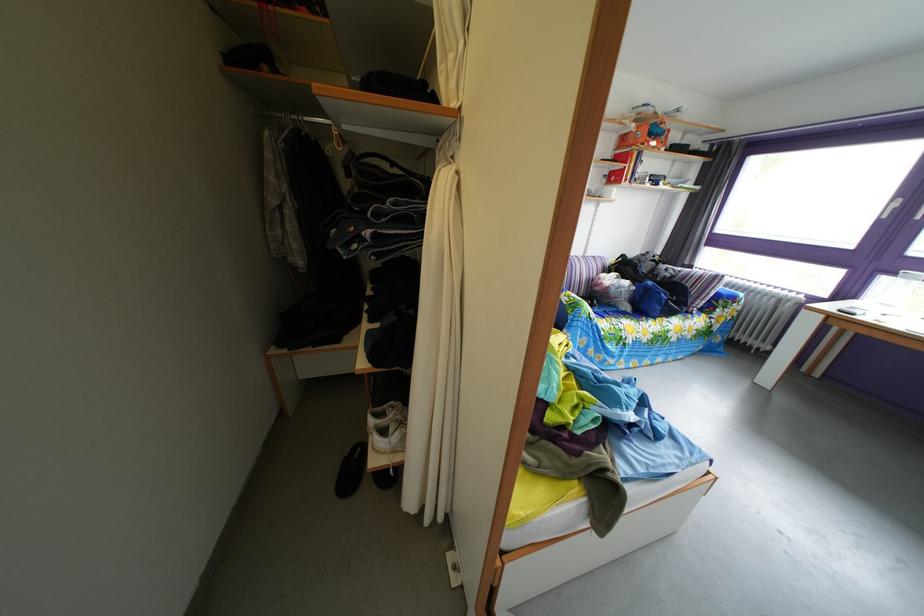
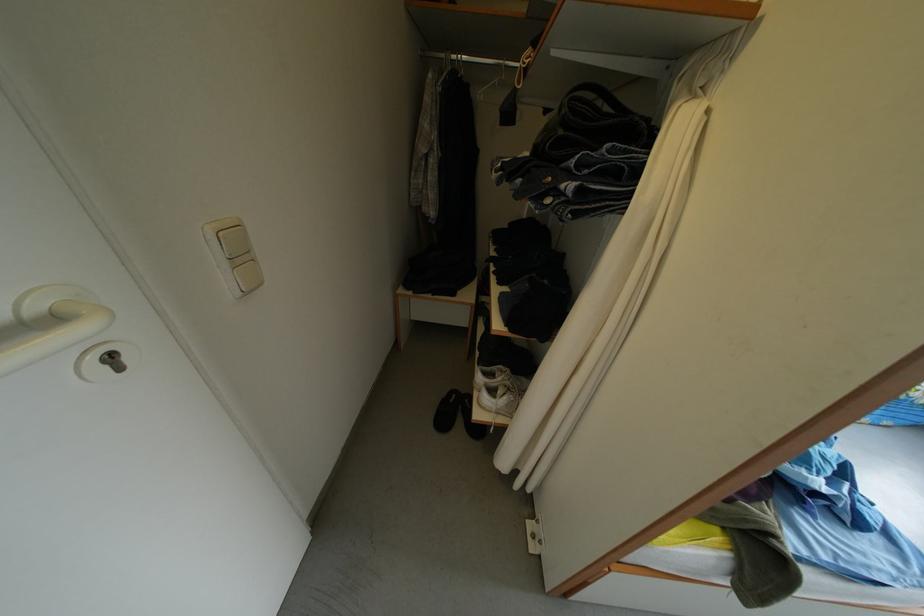
Locate, in the second image, the point that corresponds to (395,440) in the first image.

(503, 400)